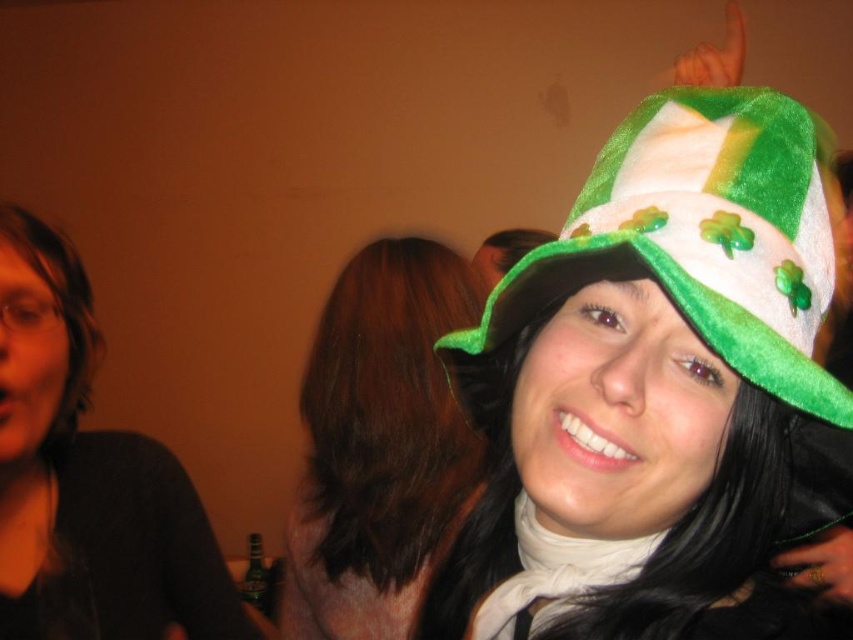
Based on the photo, does green fuzzy hat at upper center have a smaller size compared to matte black shirt at left?

Actually, green fuzzy hat at upper center might be larger than matte black shirt at left.

Is point (426, 557) closer to viewer compared to point (35, 384)?

No.

Between point (459, 323) and point (77, 508), which one is positioned in front?

Point (77, 508)

Locate an element on the screen. Image resolution: width=853 pixels, height=640 pixels. green fuzzy hat at upper center is located at coordinates (378, 444).

Is green fuzzy hat at upper right thinner than matte black shirt at left?

Incorrect, green fuzzy hat at upper right's width is not less than matte black shirt at left's.

Is green fuzzy hat at upper right to the left of matte black shirt at left from the viewer's perspective?

Incorrect, green fuzzy hat at upper right is not on the left side of matte black shirt at left.

Is point (541, 268) positioned in front of point (9, 394)?

That is True.

Locate an element on the screen. green fuzzy hat at upper right is located at coordinates (698, 237).

Is green fuzzy hat at upper right further to the viewer compared to green fuzzy hat at upper center?

That is False.

Between green fuzzy hat at upper right and green fuzzy hat at upper center, which one is positioned higher?

green fuzzy hat at upper right is above.

This screenshot has height=640, width=853. Describe the element at coordinates (698, 237) in the screenshot. I see `green fuzzy hat at upper right` at that location.

At what (x,y) coordinates should I click in order to perform the action: click on green fuzzy hat at upper right. Please return your answer as a coordinate pair (x, y). Looking at the image, I should click on (698, 237).